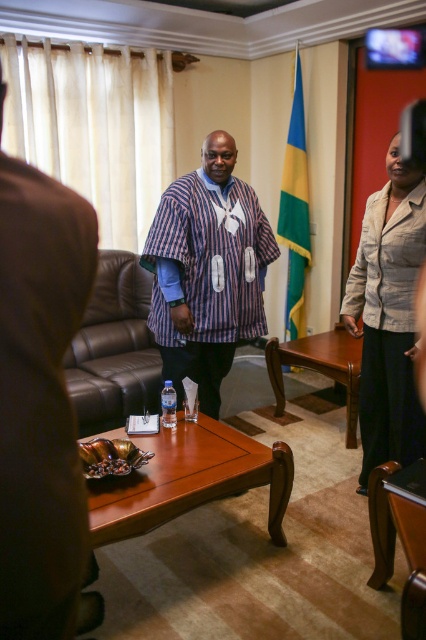
Is striped fabric at center positioned at the back of light beige fabric jacket at right?

No, it is not.

Based on the photo, is striped fabric at center smaller than light beige fabric jacket at right?

Indeed, striped fabric at center has a smaller size compared to light beige fabric jacket at right.

Which is in front, point (14, 602) or point (412, 410)?

Point (14, 602) is in front.

Find the location of `striped fabric at center`. striped fabric at center is located at coordinates (40, 401).

Which is behind, point (299, 234) or point (319, 339)?

The point (299, 234) is behind.

Who is more forward, (294, 150) or (268, 372)?

Point (268, 372) is more forward.

Is point (301, 244) positioned before point (279, 400)?

No, it is behind (279, 400).

Find the location of `blue-green fabric flag at center-right`. blue-green fabric flag at center-right is located at coordinates (294, 212).

Is striped fabric at center closer to the viewer compared to wooden table at center?

Yes, it is.

The image size is (426, 640). I want to click on striped fabric at center, so click(x=40, y=401).

Where is `striped fabric at center`? striped fabric at center is located at coordinates (40, 401).